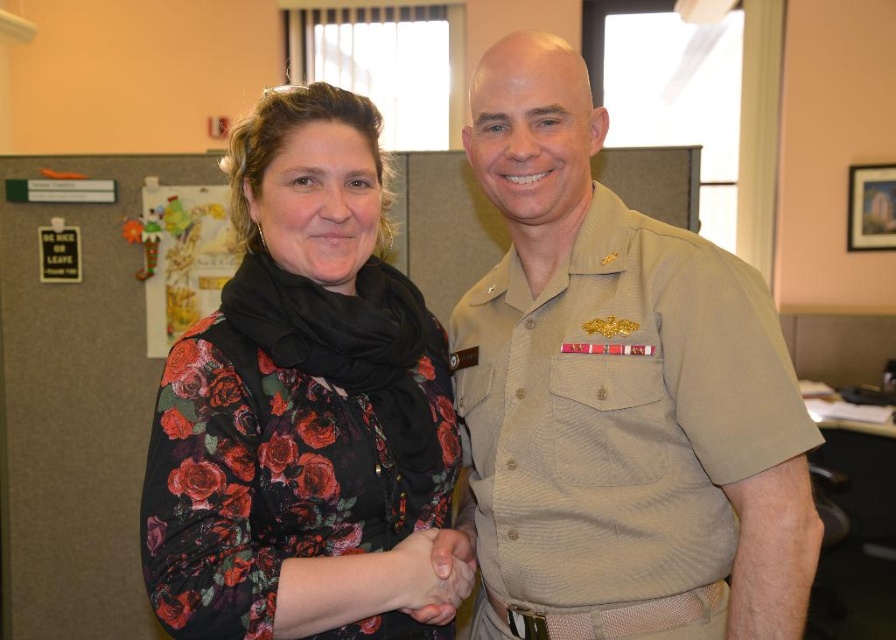
You are an office assistant who needs to hang two items on a bulletin board. The tan uniform shirt at center and the floral print blouse at center must be displayed. Since space is limited, you need to know which one is taller to arrange them properly. Which item is taller?

The tan uniform shirt at center is taller than the floral print blouse at center according to the description.

You are an office worker who needs to identify clothing items in the scene. Which item is positioned higher up between the floral print blouse at center and the smooth skin hand at center?

The floral print blouse at center is located above the smooth skin hand at center.

You are a photographer standing 10 feet away from the two people in the image. You need to capture a closeup shot of the tan uniform shirt at center and the smooth skin hand at center. Can you fit both subjects into the frame without moving closer?

The tan uniform shirt at center is 11.99 inches from the smooth skin hand at center. Since the photographer is 10 feet away, the distance between the two subjects is within a typical camera frame at that distance, so yes, both can be captured in the same closeup shot.